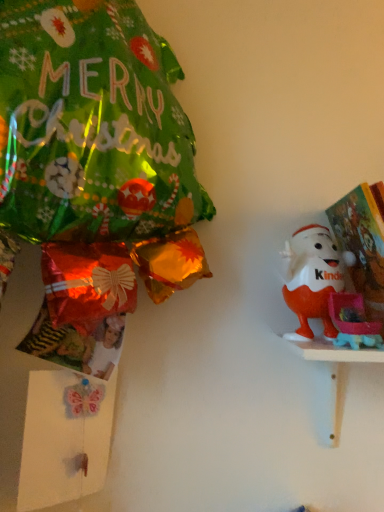
The image size is (384, 512). What are the coordinates of `orange matte kinder egg at right` in the screenshot? It's located at (312, 278).

The width and height of the screenshot is (384, 512). What do you see at coordinates (312, 278) in the screenshot? I see `orange matte kinder egg at right` at bounding box center [312, 278].

What is the approximate width of white wooden shelf at right?

It is 8.05 inches.

Measure the distance between white wooden shelf at right and camera.

white wooden shelf at right is 55.00 centimeters from camera.

This screenshot has height=512, width=384. I want to click on white wooden shelf at right, so click(x=332, y=380).

This screenshot has height=512, width=384. What do you see at coordinates (332, 380) in the screenshot?
I see `white wooden shelf at right` at bounding box center [332, 380].

At what (x,y) coordinates should I click in order to perform the action: click on orange matte kinder egg at right. Please return your answer as a coordinate pair (x, y). The width and height of the screenshot is (384, 512). Looking at the image, I should click on (312, 278).

Which object is positioned more to the right, white wooden shelf at right or orange matte kinder egg at right?

From the viewer's perspective, white wooden shelf at right appears more on the right side.

Is white wooden shelf at right further to the viewer compared to orange matte kinder egg at right?

No, white wooden shelf at right is closer to the viewer.

Is point (334, 361) closer or farther from the camera than point (312, 259)?

Point (334, 361).

From the image's perspective, is white wooden shelf at right on top of orange matte kinder egg at right?

Incorrect, from the image's perspective, white wooden shelf at right is lower than orange matte kinder egg at right.

From a real-world perspective, is white wooden shelf at right located higher than orange matte kinder egg at right?

Incorrect, from a real-world perspective, white wooden shelf at right is lower than orange matte kinder egg at right.

Looking at their sizes, would you say white wooden shelf at right is wider or thinner than orange matte kinder egg at right?

In the image, white wooden shelf at right appears to be wider than orange matte kinder egg at right.

Based on the photo, who is taller, white wooden shelf at right or orange matte kinder egg at right?

Standing taller between the two is orange matte kinder egg at right.

Does white wooden shelf at right have a larger size compared to orange matte kinder egg at right?

Correct, white wooden shelf at right is larger in size than orange matte kinder egg at right.

Is white wooden shelf at right situated inside orange matte kinder egg at right or outside?

white wooden shelf at right lies outside orange matte kinder egg at right.

Is white wooden shelf at right far away from orange matte kinder egg at right?

No, white wooden shelf at right is not far away from orange matte kinder egg at right.

Could you tell me if white wooden shelf at right is facing orange matte kinder egg at right?

No, white wooden shelf at right is not oriented towards orange matte kinder egg at right.

Can you tell me how much white wooden shelf at right and orange matte kinder egg at right differ in facing direction?

The facing directions of white wooden shelf at right and orange matte kinder egg at right are 0.00178 degrees apart.

Find the location of `toy above the white wooden shelf at right (from the image's perspective)`. toy above the white wooden shelf at right (from the image's perspective) is located at coordinates (312, 278).

Which object is positioned more to the left, orange matte kinder egg at right or white wooden shelf at right?

orange matte kinder egg at right is more to the left.

Is orange matte kinder egg at right closer to camera compared to white wooden shelf at right?

No, orange matte kinder egg at right is further to the viewer.

Does point (301, 262) appear closer or farther from the camera than point (357, 356)?

Point (301, 262) appears to be farther away from the viewer than point (357, 356).

From the image's perspective, is orange matte kinder egg at right above or below white wooden shelf at right?

From the image's perspective, orange matte kinder egg at right appears above white wooden shelf at right.

From a real-world perspective, is orange matte kinder egg at right physically located above or below white wooden shelf at right?

orange matte kinder egg at right is situated higher than white wooden shelf at right in the real world.

Is orange matte kinder egg at right thinner than white wooden shelf at right?

Yes, orange matte kinder egg at right is thinner than white wooden shelf at right.

Is orange matte kinder egg at right taller than white wooden shelf at right?

Yes.

Looking at the image, does orange matte kinder egg at right seem bigger or smaller compared to white wooden shelf at right?

Answer: orange matte kinder egg at right is smaller than white wooden shelf at right.

Does orange matte kinder egg at right contain white wooden shelf at right?

No, white wooden shelf at right is not a part of orange matte kinder egg at right.

Is orange matte kinder egg at right positioned far away from white wooden shelf at right?

That's not correct — orange matte kinder egg at right is a little close to white wooden shelf at right.

Does orange matte kinder egg at right turn towards white wooden shelf at right?

No, orange matte kinder egg at right does not turn towards white wooden shelf at right.

In the image, there is a orange matte kinder egg at right. What are the coordinates of `table below it (from the image's perspective)` in the screenshot? It's located at (332, 380).

The height and width of the screenshot is (512, 384). Find the location of `toy on the left of white wooden shelf at right`. toy on the left of white wooden shelf at right is located at coordinates click(312, 278).

Where is `toy that appears behind the white wooden shelf at right`? The image size is (384, 512). toy that appears behind the white wooden shelf at right is located at coordinates (312, 278).